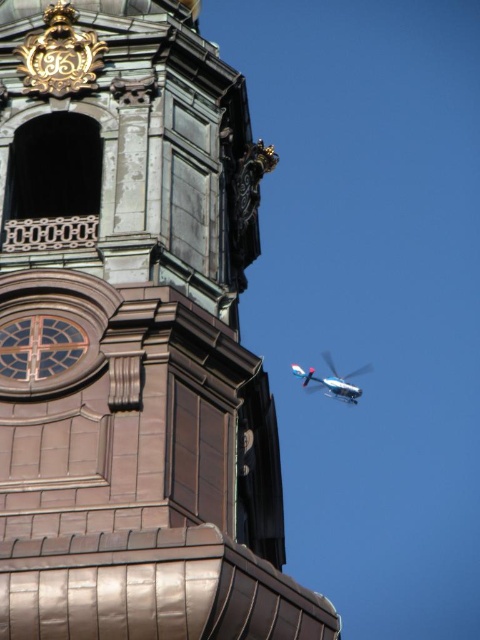
Question: Is brown stone tower at center further to the viewer compared to metallic silver helicopter at upper right?

Choices:
 (A) yes
 (B) no

Answer: (B)

Question: Does brown stone tower at center appear over metallic silver helicopter at upper right?

Choices:
 (A) yes
 (B) no

Answer: (A)

Question: Does brown stone tower at center come behind metallic silver helicopter at upper right?

Choices:
 (A) no
 (B) yes

Answer: (A)